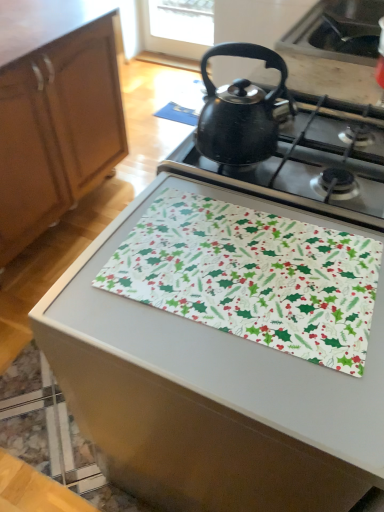
The height and width of the screenshot is (512, 384). In order to click on empty space that is ontop of white fabric with holiday pattern at center (from a real-world perspective) in this screenshot , I will do `click(252, 258)`.